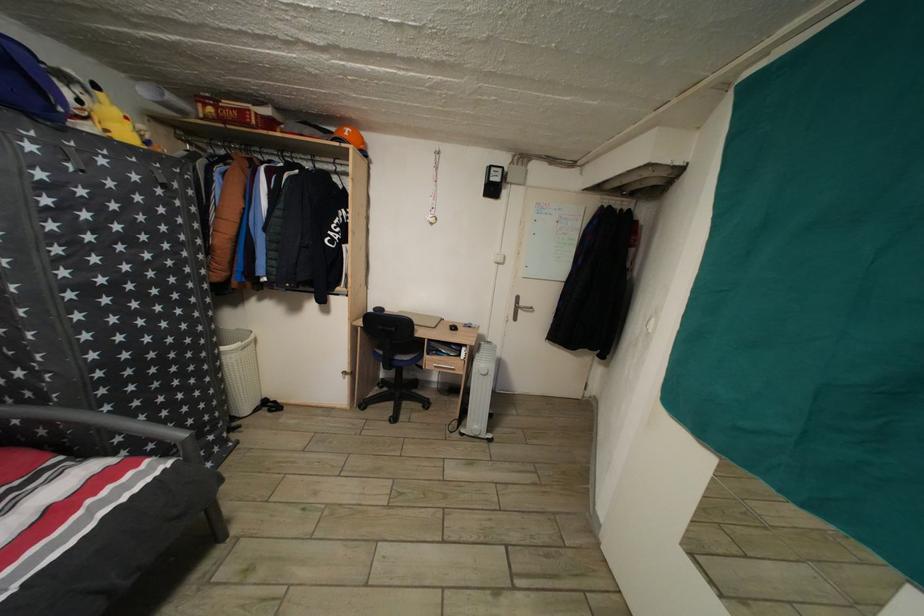
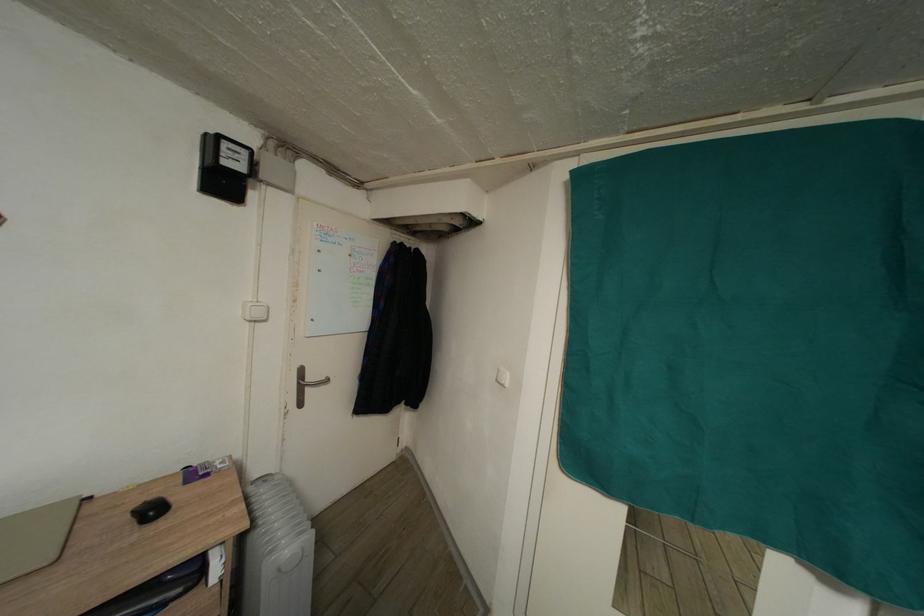
Question: The camera is either moving clockwise (left) or counter-clockwise (right) around the object. The first image is from the beginning of the video and the second image is from the end. Is the camera moving left or right when shooting the video?

Choices:
 (A) Left
 (B) Right

Answer: (A)